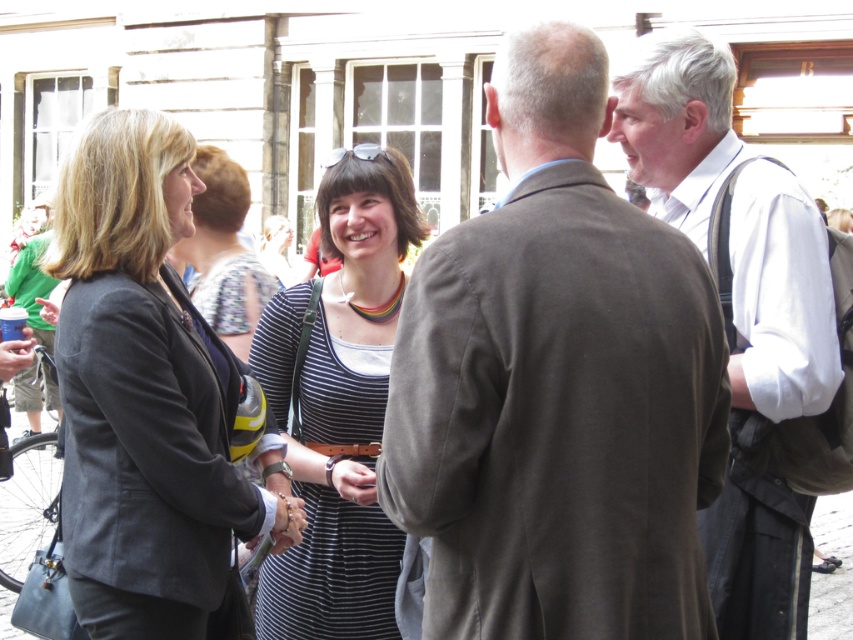
Between gray wool suit at center and striped fabric dress at center, which one is positioned lower?

striped fabric dress at center

Can you confirm if gray wool suit at center is positioned to the left of striped fabric dress at center?

In fact, gray wool suit at center is to the right of striped fabric dress at center.

Find the location of `gray wool suit at center`. gray wool suit at center is located at coordinates (556, 385).

Is point (749, 289) more distant than point (318, 490)?

No, it is in front of (318, 490).

Does white shirt at upper right come behind striped fabric dress at center?

No, white shirt at upper right is closer to the viewer.

Between point (830, 332) and point (367, 627), which one is positioned in front?

Point (830, 332) is in front.

Locate an element on the screen. This screenshot has height=640, width=853. white shirt at upper right is located at coordinates [778, 300].

Does matte black blazer at left have a greater width compared to white shirt at upper right?

Incorrect, matte black blazer at left's width does not surpass white shirt at upper right's.

Looking at this image, does matte black blazer at left come in front of white shirt at upper right?

No.

You are a GUI agent. You are given a task and a screenshot of the screen. Output one action in this format:
    pyautogui.click(x=<x>, y=<y>)
    Task: Click on the matte black blazer at left
    The width and height of the screenshot is (853, 640).
    Given the screenshot: What is the action you would take?
    pyautogui.click(x=148, y=397)